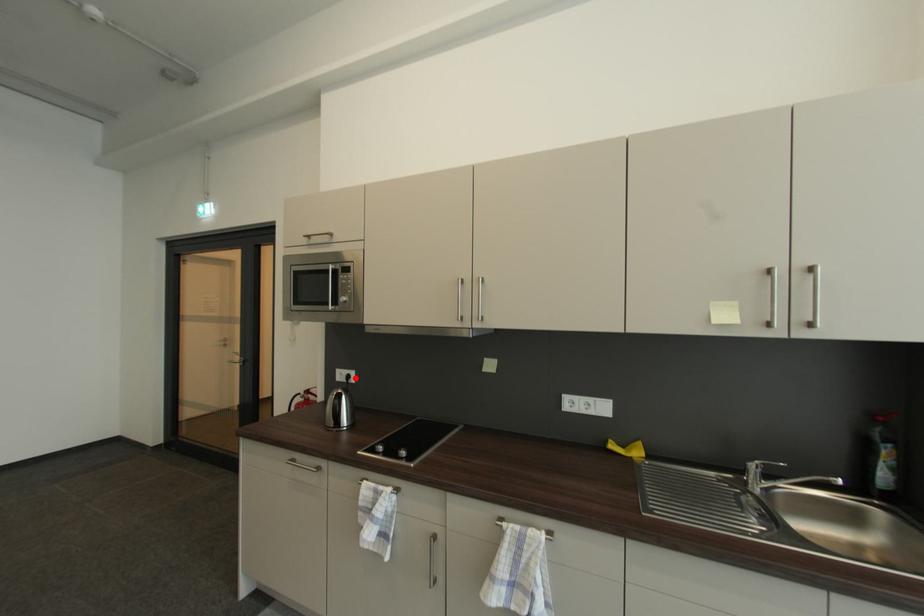
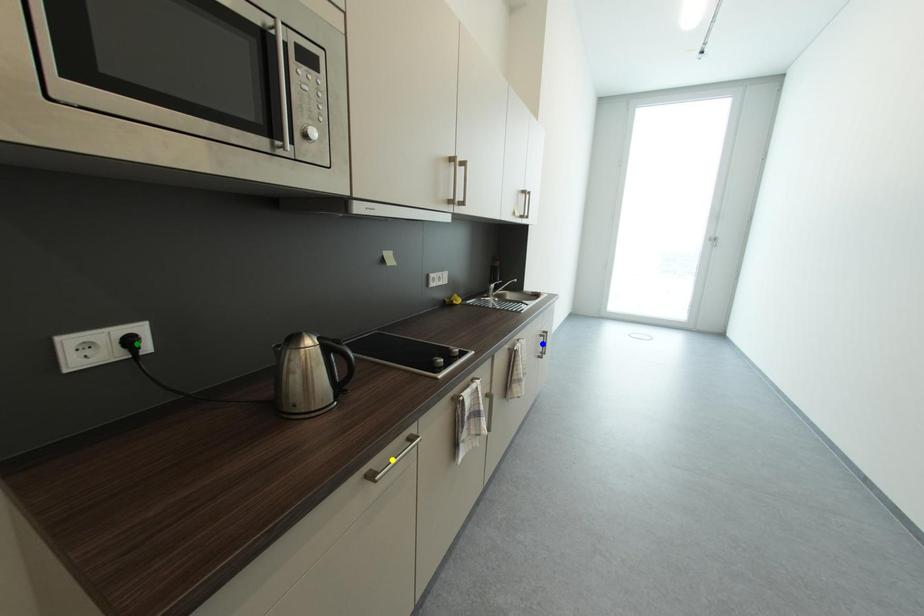
Question: I am providing you with two images of the same scene from different viewpoints. A red point is marked on the first image. You are given multiple points on the second image. Can you choose the point in image 2 that corresponds to the point in image 1?

Choices:
 (A) yellow point
 (B) green point
 (C) blue point

Answer: (B)